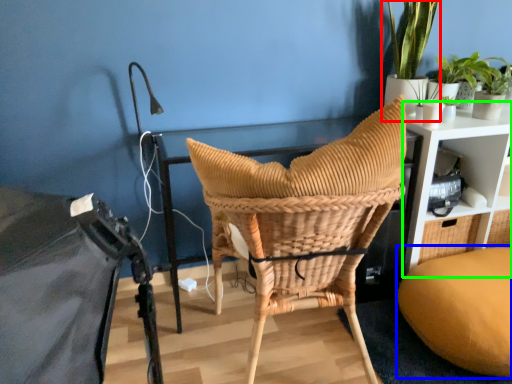
Question: Estimate the real-world distances between objects in this image. Which object is closer to houseplant (highlighted by a red box), bean bag chair (highlighted by a blue box) or shelf (highlighted by a green box)?

Choices:
 (A) bean bag chair
 (B) shelf

Answer: (B)